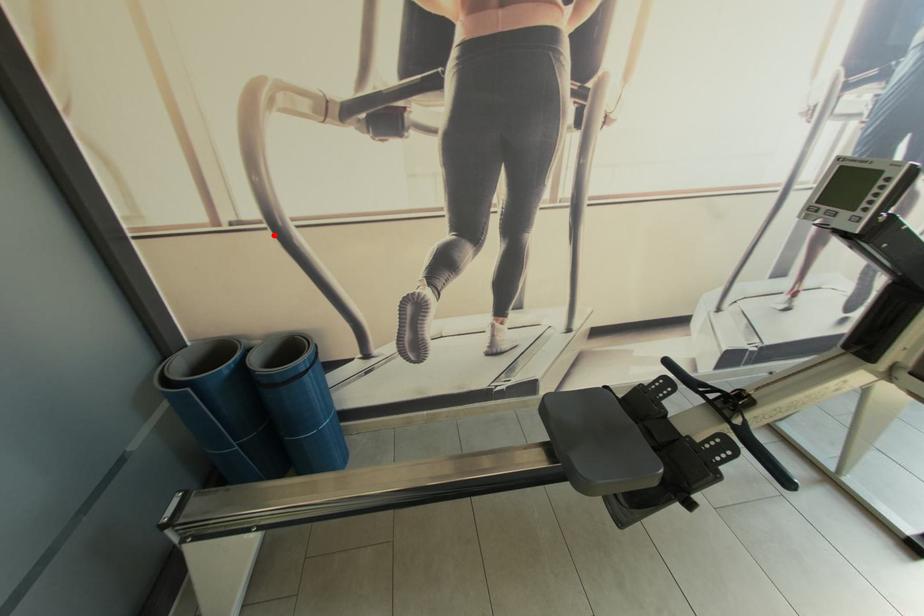
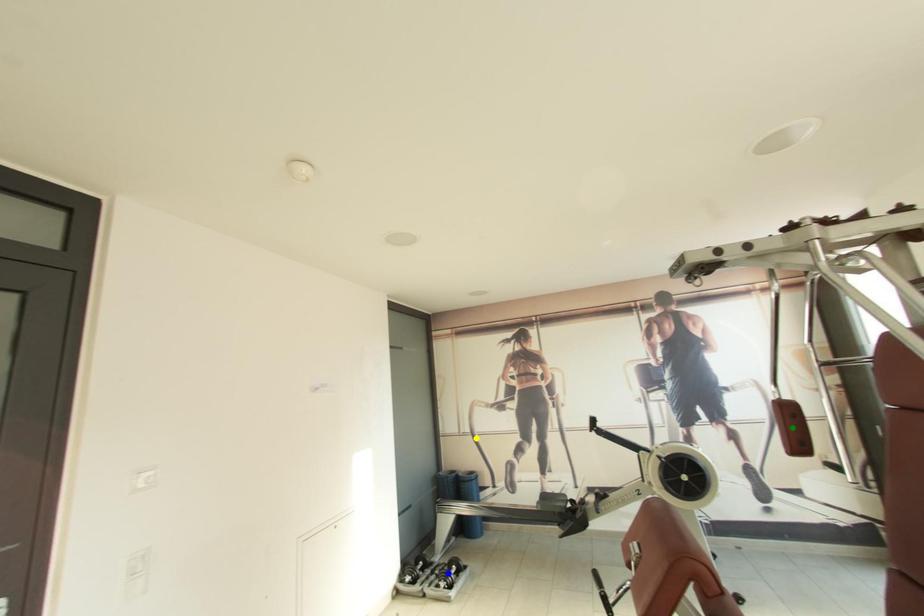
Question: I am providing you with two images of the same scene from different viewpoints. A red point is marked on the first image. You are given multiple points on the second image. Which spot in image 2 lines up with the point in image 1?

Choices:
 (A) green point
 (B) yellow point
 (C) blue point

Answer: (B)